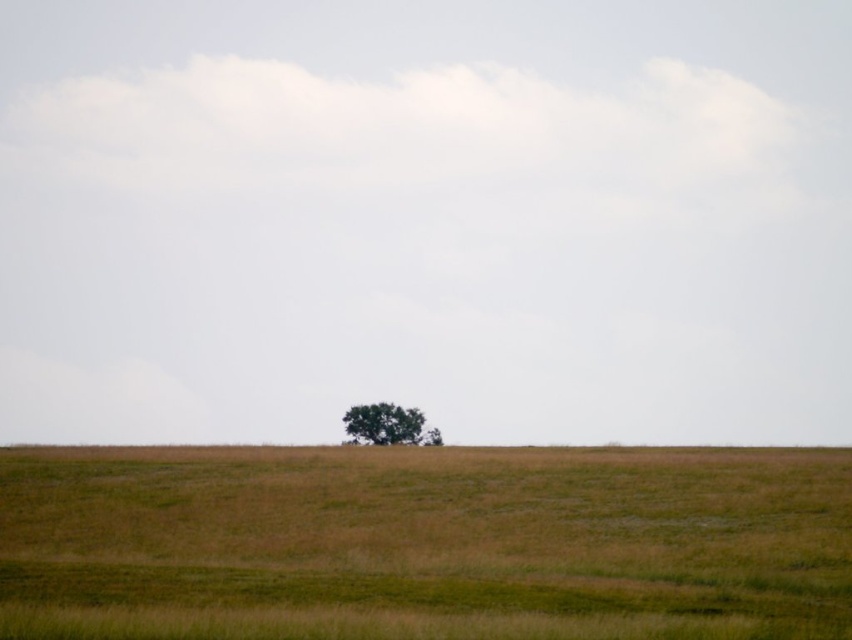
The image size is (852, 640). Describe the element at coordinates (424, 541) in the screenshot. I see `green grass at center` at that location.

Does green grass at center appear over green leafy tree at center?

Indeed, green grass at center is positioned over green leafy tree at center.

Which is in front, point (545, 458) or point (344, 429)?

Point (545, 458)

Locate an element on the screen. The height and width of the screenshot is (640, 852). green grass at center is located at coordinates [424, 541].